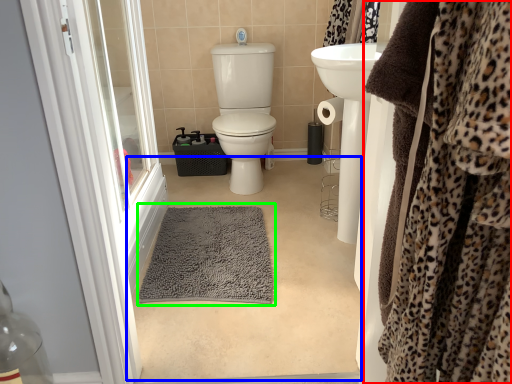
Question: Which object is the farthest from clothing (highlighted by a red box)? Choose among these: plain (highlighted by a blue box) or bath mat (highlighted by a green box).

Choices:
 (A) plain
 (B) bath mat

Answer: (B)